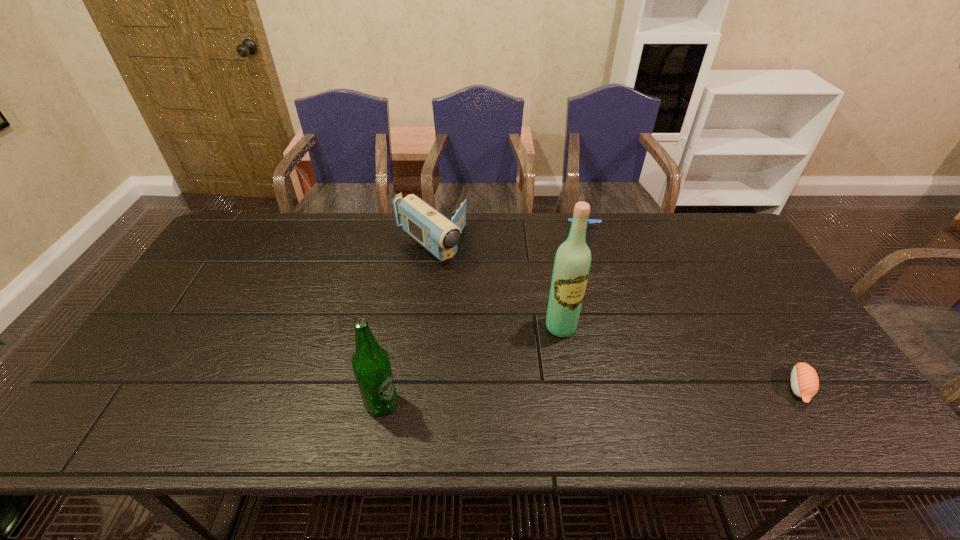
Locate an element on the screen. The width and height of the screenshot is (960, 540). free region located on the front-facing side of the tallest object is located at coordinates (591, 374).

This screenshot has width=960, height=540. I want to click on blank space located on the front-facing side of the tallest object, so click(589, 371).

Locate an element on the screen. free location located on the side of the camcorder with the flip-out screen is located at coordinates (530, 330).

Find the location of a particular element. The height and width of the screenshot is (540, 960). blank space located 0.060m on the side of the camcorder with the flip-out screen is located at coordinates (464, 276).

This screenshot has height=540, width=960. In order to click on vacant area located on the side of the camcorder with the flip-out screen in this screenshot , I will do `click(499, 305)`.

What are the coordinates of `vacant point located on the front-facing side of the Lego` in the screenshot? It's located at (597, 306).

Where is `vacant space located on the front-facing side of the Lego`? The width and height of the screenshot is (960, 540). vacant space located on the front-facing side of the Lego is located at coordinates (588, 253).

Where is `free space located on the front-facing side of the Lego`? Image resolution: width=960 pixels, height=540 pixels. free space located on the front-facing side of the Lego is located at coordinates (598, 313).

At what (x,y) coordinates should I click in order to perform the action: click on camcorder that is at the far edge. Please return your answer as a coordinate pair (x, y). This screenshot has height=540, width=960. Looking at the image, I should click on (436, 233).

Where is `Lego that is at the far edge`? This screenshot has height=540, width=960. Lego that is at the far edge is located at coordinates point(590,221).